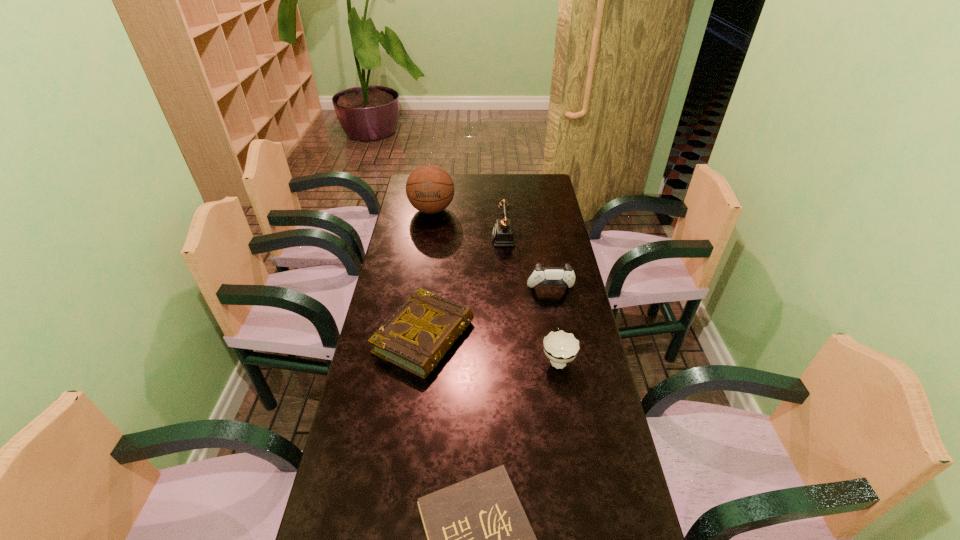
This screenshot has width=960, height=540. What are the coordinates of `vacant point located between the cup and the control` in the screenshot? It's located at [x=554, y=325].

The image size is (960, 540). I want to click on vacant space that is in between the cup and the farther hardback book, so click(x=491, y=348).

Where is `free space between the farther hardback book and the fifth nearest object`? This screenshot has height=540, width=960. free space between the farther hardback book and the fifth nearest object is located at coordinates (466, 288).

The height and width of the screenshot is (540, 960). I want to click on free spot between the farthest object and the telephone, so click(469, 225).

Where is `vacant space in between the cup and the fourth nearest object`? The height and width of the screenshot is (540, 960). vacant space in between the cup and the fourth nearest object is located at coordinates (554, 325).

Find the location of `object that stands as the second closest to the second farthest object`. object that stands as the second closest to the second farthest object is located at coordinates (541, 275).

What are the coordinates of `object that stands as the fifth closest to the farthest object` in the screenshot? It's located at (479, 539).